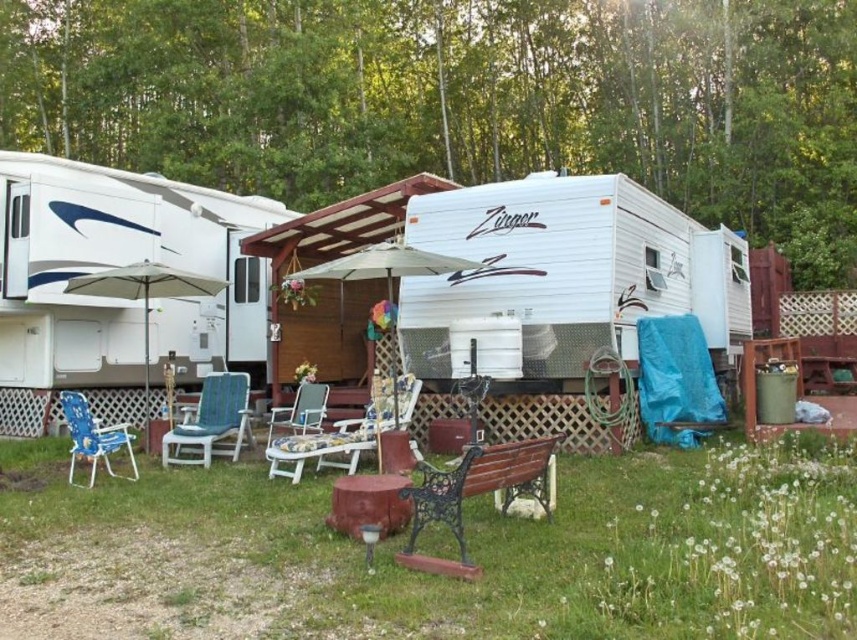
Question: Which object is farther from the camera taking this photo?

Choices:
 (A) blue plastic chair at lower left
 (B) wooden bench at center

Answer: (A)

Question: Observing the image, what is the correct spatial positioning of white glossy recreational vehicle at left in reference to blue plastic chair at lower left?

Choices:
 (A) above
 (B) below

Answer: (A)

Question: Based on their relative distances, which object is farther from the wooden bench at center?

Choices:
 (A) white matte camper at center
 (B) plastic cushioned chair at center
 (C) blue fabric chair at center

Answer: (A)

Question: Which point appears closest to the camera in this image?

Choices:
 (A) (321, 388)
 (B) (626, 556)
 (C) (195, 452)

Answer: (B)

Question: Is white matte camper at center to the left of plastic cushioned chair at center from the viewer's perspective?

Choices:
 (A) yes
 (B) no

Answer: (B)

Question: Is the position of white matte camper at center less distant than that of plastic cushioned chair at center?

Choices:
 (A) yes
 (B) no

Answer: (B)